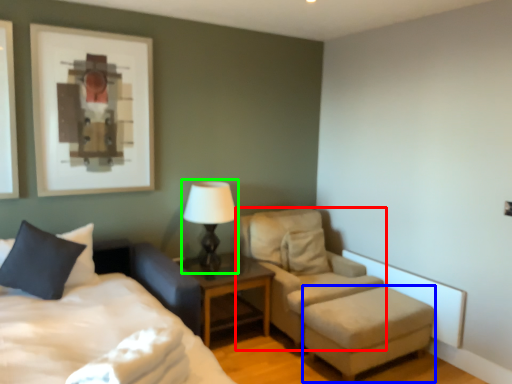
Question: Estimate the real-world distances between objects in this image. Which object is closer to chair (highlighted by a red box), stool (highlighted by a blue box) or table lamp (highlighted by a green box)?

Choices:
 (A) stool
 (B) table lamp

Answer: (A)